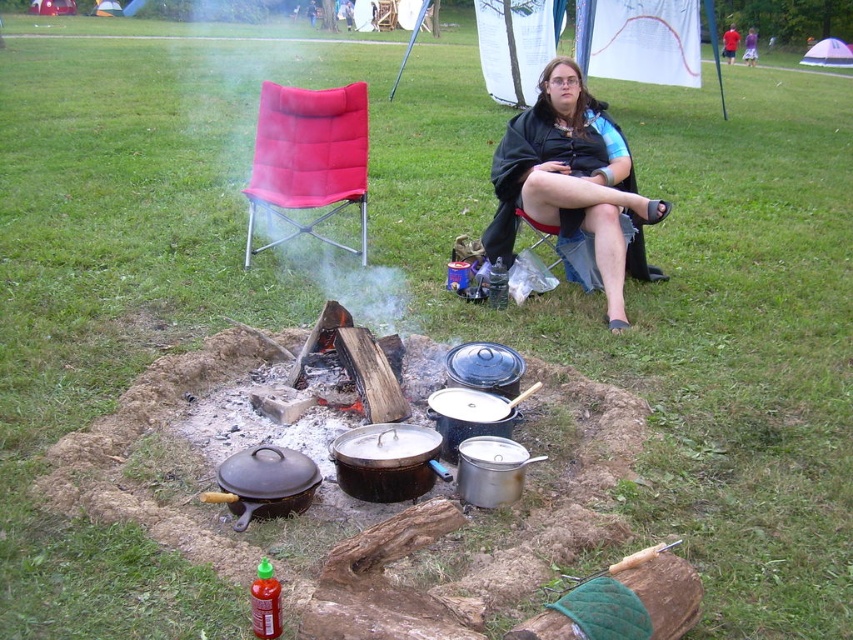
Question: Is black fabric cape at center wider than red fabric folding chair at center?

Choices:
 (A) yes
 (B) no

Answer: (A)

Question: Can you confirm if black fabric cape at center is positioned below red fabric folding chair at center?

Choices:
 (A) no
 (B) yes

Answer: (B)

Question: Does black fabric cape at center have a smaller size compared to red fabric folding chair at center?

Choices:
 (A) no
 (B) yes

Answer: (A)

Question: Which of the following is the farthest from the observer?

Choices:
 (A) red fabric folding chair at center
 (B) black fabric cape at center

Answer: (A)

Question: Which of the following is the farthest from the observer?

Choices:
 (A) (247, 268)
 (B) (589, 100)

Answer: (A)